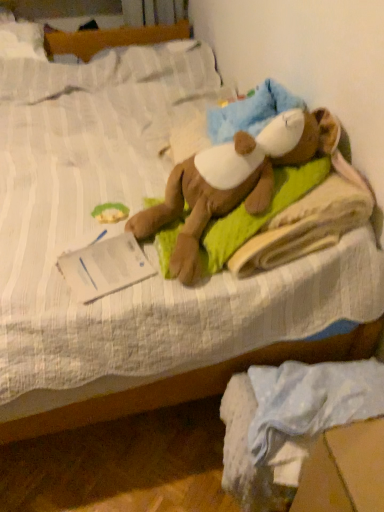
At what (x,y) coordinates should I click in order to perform the action: click on green fabric at upper left. Please return your answer as a coordinate pair (x, y). This screenshot has height=512, width=384. Looking at the image, I should click on (110, 212).

The height and width of the screenshot is (512, 384). I want to click on soft brown plush toy at center, so click(233, 180).

Where is `green fabric at upper left`? The width and height of the screenshot is (384, 512). green fabric at upper left is located at coordinates click(110, 212).

Is white cotton fabric at lower right looking in the opposite direction of green fabric at upper left?

No, white cotton fabric at lower right is not facing the opposite direction of green fabric at upper left.

This screenshot has width=384, height=512. In order to click on material below the green fabric at upper left (from the image's perspective) in this screenshot , I will do point(289,422).

Can you confirm if white cotton fabric at lower right is smaller than green fabric at upper left?

No.

Between white cotton fabric at lower right and green fabric at upper left, which one is positioned in front?

white cotton fabric at lower right is more forward.

From a real-world perspective, who is located higher, soft brown plush toy at center or green fabric at upper left?

soft brown plush toy at center is physically above.

Does soft brown plush toy at center lie in front of green fabric at upper left?

That is True.

Between soft brown plush toy at center and green fabric at upper left, which one has smaller width?

green fabric at upper left.

Consider the image. How different are the orientations of soft brown plush toy at center and green fabric at upper left in degrees?

The angular difference between soft brown plush toy at center and green fabric at upper left is 86.1 degrees.

Is green fabric at upper left wider than white cotton fabric at lower right?

In fact, green fabric at upper left might be narrower than white cotton fabric at lower right.

Who is more distant, green fabric at upper left or white cotton fabric at lower right?

green fabric at upper left is further away from the camera.

From a real-world perspective, does green fabric at upper left stand above white cotton fabric at lower right?

Correct, in the physical world, green fabric at upper left is higher than white cotton fabric at lower right.

From the image's perspective, between soft brown plush toy at center and white cotton fabric at lower right, who is located below?

white cotton fabric at lower right.

Would you say soft brown plush toy at center is inside or outside white cotton fabric at lower right?

soft brown plush toy at center is not inside white cotton fabric at lower right, it's outside.

Is soft brown plush toy at center to the right of white cotton fabric at lower right from the viewer's perspective?

Incorrect, soft brown plush toy at center is not on the right side of white cotton fabric at lower right.

Is soft brown plush toy at center bigger or smaller than white cotton fabric at lower right?

Clearly, soft brown plush toy at center is larger in size than white cotton fabric at lower right.

Is green fabric at upper left not near soft brown plush toy at center?

No.

Who is shorter, green fabric at upper left or soft brown plush toy at center?

Standing shorter between the two is green fabric at upper left.

Between point (125, 213) and point (291, 118), which one is positioned in front?

The point (291, 118) is more forward.

Considering the relative sizes of green fabric at upper left and soft brown plush toy at center in the image provided, is green fabric at upper left thinner than soft brown plush toy at center?

Correct, the width of green fabric at upper left is less than that of soft brown plush toy at center.

In the scene shown: What's the angular difference between white cotton fabric at lower right and soft brown plush toy at center's facing directions?

They differ by 77.3 degrees in their facing directions.

Is white cotton fabric at lower right outside of soft brown plush toy at center?

Yes, white cotton fabric at lower right is located beyond the bounds of soft brown plush toy at center.

Is white cotton fabric at lower right positioned behind soft brown plush toy at center?

That is False.

Which is closer to the camera, (304, 374) or (154, 228)?

Point (304, 374) is closer to the camera than point (154, 228).

Identify the location of toy on the left of the white cotton fabric at lower right. The width and height of the screenshot is (384, 512). (110, 212).

This screenshot has height=512, width=384. In order to click on person located on the right of green fabric at upper left in this screenshot , I will do `click(233, 180)`.

From the image, which object appears to be nearer to soft brown plush toy at center, white cotton fabric at lower right or green fabric at upper left?

green fabric at upper left lies closer to soft brown plush toy at center than the other object.

Estimate the real-world distances between objects in this image. Which object is further from white cotton fabric at lower right, green fabric at upper left or soft brown plush toy at center?

Based on the image, green fabric at upper left appears to be further to white cotton fabric at lower right.

Looking at the image, which one is located closer to soft brown plush toy at center, green fabric at upper left or white cotton fabric at lower right?

The object closer to soft brown plush toy at center is green fabric at upper left.

Estimate the real-world distances between objects in this image. Which object is closer to green fabric at upper left, soft brown plush toy at center or white cotton fabric at lower right?

Based on the image, soft brown plush toy at center appears to be nearer to green fabric at upper left.

Estimate the real-world distances between objects in this image. Which object is further from green fabric at upper left, white cotton fabric at lower right or soft brown plush toy at center?

The object further to green fabric at upper left is white cotton fabric at lower right.

Looking at the image, which one is located further to white cotton fabric at lower right, soft brown plush toy at center or green fabric at upper left?

The object further to white cotton fabric at lower right is green fabric at upper left.

This screenshot has height=512, width=384. Find the location of `toy between soft brown plush toy at center and white cotton fabric at lower right from top to bottom`. toy between soft brown plush toy at center and white cotton fabric at lower right from top to bottom is located at coordinates (110, 212).